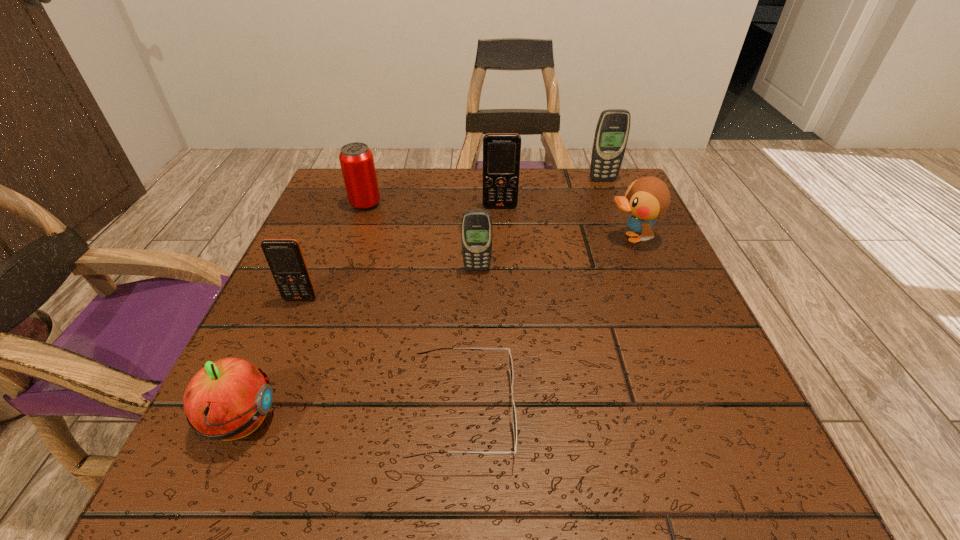
Where is `vacant space located on the screen of the smaller gray cellular telephone`? Image resolution: width=960 pixels, height=540 pixels. vacant space located on the screen of the smaller gray cellular telephone is located at coordinates (477, 308).

Where is `free space located on the back of the apple`? The width and height of the screenshot is (960, 540). free space located on the back of the apple is located at coordinates (272, 350).

Where is `vacant space located 0.180m on the front-facing side of the sunglasses`? The height and width of the screenshot is (540, 960). vacant space located 0.180m on the front-facing side of the sunglasses is located at coordinates (638, 411).

I want to click on can positioned at the far edge, so pyautogui.click(x=356, y=159).

Find the location of a particular element. This screenshot has height=540, width=960. apple situated at the near edge is located at coordinates (228, 399).

In order to click on sunglasses at the near edge in this screenshot , I will do `click(513, 410)`.

Find the location of a particular element. can situated at the left edge is located at coordinates (356, 159).

I want to click on cellular telephone present at the left edge, so click(285, 258).

This screenshot has height=540, width=960. I want to click on apple positioned at the left edge, so click(228, 399).

Where is `cellular telephone that is at the right edge`? The height and width of the screenshot is (540, 960). cellular telephone that is at the right edge is located at coordinates (612, 131).